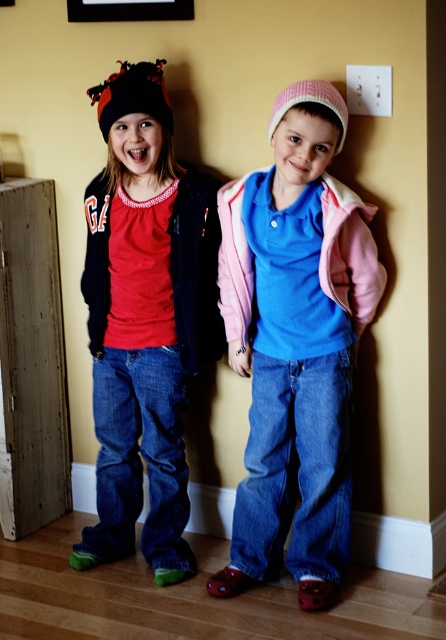
Question: Considering the relative positions of pink fleece jacket at center and matte black beanie at left in the image provided, where is pink fleece jacket at center located with respect to matte black beanie at left?

Choices:
 (A) left
 (B) right

Answer: (B)

Question: Which object appears closest to the camera in this image?

Choices:
 (A) black plastic picture frame at upper center
 (B) matte black beanie at left

Answer: (B)

Question: Can you confirm if pink fleece jacket at center is positioned above matte black beanie at left?

Choices:
 (A) yes
 (B) no

Answer: (B)

Question: Can you confirm if pink fleece jacket at center is positioned to the right of matte black beanie at left?

Choices:
 (A) yes
 (B) no

Answer: (A)

Question: Based on their relative distances, which object is farther from the black plastic picture frame at upper center?

Choices:
 (A) pink fleece jacket at center
 (B) matte black beanie at left

Answer: (A)

Question: Which is farther from the black plastic picture frame at upper center?

Choices:
 (A) matte black beanie at left
 (B) pink fleece jacket at center

Answer: (B)